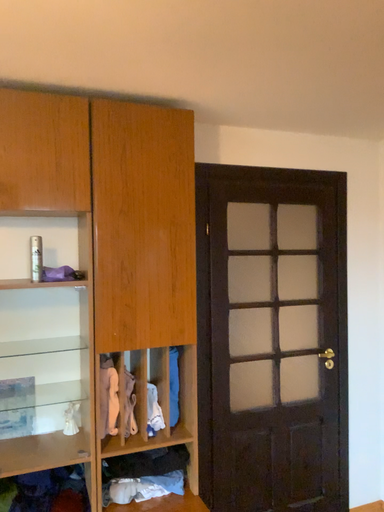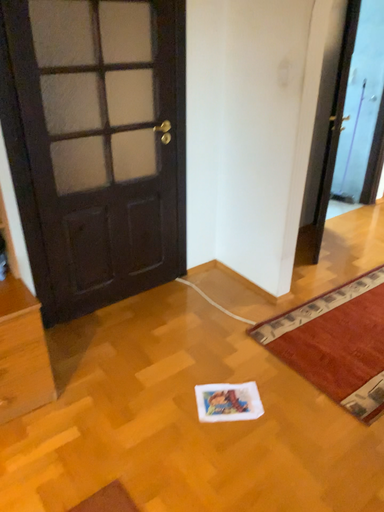
Question: How did the camera likely rotate when shooting the video?

Choices:
 (A) rotated upward
 (B) rotated downward

Answer: (B)